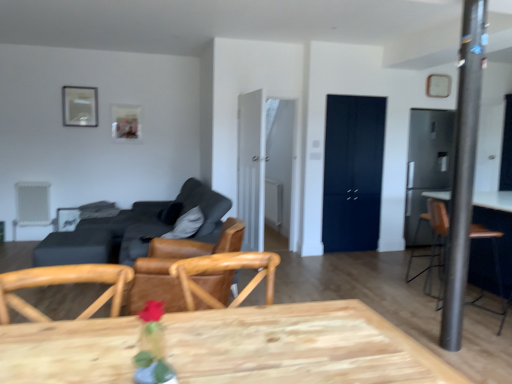
This screenshot has height=384, width=512. What do you see at coordinates (437, 236) in the screenshot? I see `brown leather armchair at right, which appears as the 1th armchair when viewed from the front` at bounding box center [437, 236].

This screenshot has height=384, width=512. What do you see at coordinates (73, 248) in the screenshot?
I see `wooden table at lower left` at bounding box center [73, 248].

Describe the element at coordinates (126, 123) in the screenshot. I see `metallic silver picture frame at upper center, the first picture frame positioned from the back` at that location.

The width and height of the screenshot is (512, 384). What do you see at coordinates (463, 170) in the screenshot?
I see `metallic pole at right` at bounding box center [463, 170].

What do you see at coordinates (170, 264) in the screenshot? I see `brown leather chair at center` at bounding box center [170, 264].

The width and height of the screenshot is (512, 384). In order to click on brown leather armchair at right, which appears as the 1th armchair when viewed from the front in this screenshot , I will do `click(437, 236)`.

Who is shorter, metallic pole at right or brown leather chair at center?

Standing shorter between the two is brown leather chair at center.

Does metallic pole at right turn towards brown leather chair at center?

No, metallic pole at right does not turn towards brown leather chair at center.

From a real-world perspective, is metallic pole at right located beneath brown leather chair at center?

No, from a real-world perspective, metallic pole at right is not under brown leather chair at center.

Is metallic pole at right not near brown leather chair at center?

Yes, metallic pole at right and brown leather chair at center are quite far apart.

Is wooden table at lower left bigger or smaller than satin black refrigerator at right?

In the image, wooden table at lower left appears to be smaller than satin black refrigerator at right.

From a real-world perspective, is wooden table at lower left physically located above or below satin black refrigerator at right?

From a real-world perspective, wooden table at lower left is physically below satin black refrigerator at right.

You are a GUI agent. You are given a task and a screenshot of the screen. Output one action in this format:
    pyautogui.click(x=<x>, y=<y>)
    Task: Click on the table located below the satin black refrigerator at right (from the image's perspective)
    
    Given the screenshot: What is the action you would take?
    pyautogui.click(x=73, y=248)

Between wooden table at lower left and satin black refrigerator at right, which one has smaller width?

satin black refrigerator at right.

Is brown leather chair at center positioned beyond the bounds of metallic pole at right?

Yes.

How many degrees apart are the facing directions of brown leather chair at center and metallic pole at right?

105 degrees separate the facing orientations of brown leather chair at center and metallic pole at right.

Is brown leather chair at center looking in the opposite direction of metallic pole at right?

That's right, brown leather chair at center is facing away from metallic pole at right.

Is wooden picture frame at upper right, marked as the 1th picture frame in a right-to-left arrangement, to the left or to the right of metallic pole at right in the image?

wooden picture frame at upper right, marked as the 1th picture frame in a right-to-left arrangement, is positioned on metallic pole at right's right side.

Are wooden picture frame at upper right, the 3th picture frame when ordered from left to right, and metallic pole at right making contact?

wooden picture frame at upper right, the 3th picture frame when ordered from left to right, and metallic pole at right are clearly separated.

From the image's perspective, which object appears higher, wooden picture frame at upper right, placed as the 1th picture frame when sorted from front to back, or metallic pole at right?

wooden picture frame at upper right, placed as the 1th picture frame when sorted from front to back, is shown above in the image.

Choose the correct answer: Is brown leather chair at center inside wooden picture frame at upper right, the 3th picture frame when ordered from left to right, or outside it?

brown leather chair at center exists outside the volume of wooden picture frame at upper right, the 3th picture frame when ordered from left to right.

Considering the sizes of objects brown leather chair at center and wooden picture frame at upper right, marked as the 1th picture frame in a right-to-left arrangement, in the image provided, who is wider, brown leather chair at center or wooden picture frame at upper right, marked as the 1th picture frame in a right-to-left arrangement,?

brown leather chair at center is wider.

Is point (187, 255) closer or farther from the camera than point (430, 82)?

Point (187, 255) appears to be closer to the viewer than point (430, 82).

Is brown leather chair at center next to wooden picture frame at upper right, the 3th picture frame when ordered from left to right, and touching it?

brown leather chair at center is not next to wooden picture frame at upper right, the 3th picture frame when ordered from left to right, and they're not touching.

Does point (464, 76) appear closer or farther from the camera than point (57, 232)?

Point (464, 76) is closer to the camera than point (57, 232).

Can we say metallic pole at right lies outside wooden table at lower left?

Yes, metallic pole at right is outside of wooden table at lower left.

From the image's perspective, which one is positioned lower, metallic pole at right or wooden table at lower left?

wooden table at lower left, from the image's perspective.

Find the location of `beam on the right of wooden table at lower left`. beam on the right of wooden table at lower left is located at coordinates (463, 170).

From a real-world perspective, who is located higher, metallic silver picture frame at upper center, arranged as the second picture frame when viewed from the left, or dark gray fabric couch at center-left?

metallic silver picture frame at upper center, arranged as the second picture frame when viewed from the left, from a real-world perspective.

Can dark gray fabric couch at center-left be found inside metallic silver picture frame at upper center, positioned as the third picture frame in front-to-back order?

Definitely not — dark gray fabric couch at center-left is not inside metallic silver picture frame at upper center, positioned as the third picture frame in front-to-back order.

Find the location of a particular element. The height and width of the screenshot is (384, 512). studio couch located underneath the metallic silver picture frame at upper center, arranged as the second picture frame when viewed from the left (from a real-world perspective) is located at coordinates (132, 230).

The image size is (512, 384). Find the location of `beam above the brown leather chair at center (from the image's perspective)`. beam above the brown leather chair at center (from the image's perspective) is located at coordinates pyautogui.click(x=463, y=170).

There is a wooden table at lower left. What are the coordinates of `appliance above it (from a real-world perspective)` in the screenshot? It's located at (426, 167).

Looking at the image, which one is located further to satin black refrigerator at right, brown leather armchair at right, which is counted as the 2th armchair, starting from the left, or brown leather chair at center?

The object further to satin black refrigerator at right is brown leather chair at center.

From the image, which object appears to be nearer to brown leather armchair at right, which appears as the 2th armchair when viewed from the back, dark gray fabric couch at center-left or metallic pole at right?

metallic pole at right lies closer to brown leather armchair at right, which appears as the 2th armchair when viewed from the back, than the other object.

Estimate the real-world distances between objects in this image. Which object is further from brown leather chair at center, wooden table at lower left or metallic silver picture frame at upper left, the 2th picture frame viewed from the front?

metallic silver picture frame at upper left, the 2th picture frame viewed from the front, is further to brown leather chair at center.

Based on their spatial positions, is leather armchair at left, placed as the 1th armchair when sorted from back to front, or metallic silver picture frame at upper center, positioned as the third picture frame in front-to-back order, further from wooden table at lower left?

Among the two, metallic silver picture frame at upper center, positioned as the third picture frame in front-to-back order, is located further to wooden table at lower left.

From the image, which object appears to be nearer to dark gray fabric couch at center-left, metallic pole at right or brown leather chair at center?

The object closer to dark gray fabric couch at center-left is brown leather chair at center.

Looking at the image, which one is located closer to metallic silver picture frame at upper left, the 3th picture frame positioned from the right, metallic silver picture frame at upper center, positioned as the third picture frame in front-to-back order, or brown leather armchair at right, which appears as the 1th armchair when viewed from the front?

metallic silver picture frame at upper center, positioned as the third picture frame in front-to-back order.

Estimate the real-world distances between objects in this image. Which object is further from metallic silver picture frame at upper center, positioned as the third picture frame in front-to-back order, wooden table at lower left or brown leather armchair at right, which appears as the 1th armchair when viewed from the right?

Among the two, brown leather armchair at right, which appears as the 1th armchair when viewed from the right, is located further to metallic silver picture frame at upper center, positioned as the third picture frame in front-to-back order.

Based on their spatial positions, is dark gray fabric couch at center-left or wooden picture frame at upper right, the 3th picture frame when ordered from left to right, closer to metallic silver picture frame at upper center, the first picture frame positioned from the back?

Based on the image, dark gray fabric couch at center-left appears to be nearer to metallic silver picture frame at upper center, the first picture frame positioned from the back.

Find the location of a particular element. The image size is (512, 384). appliance between brown leather chair at center and wooden picture frame at upper right, which ranks as the 3th picture frame in back-to-front order, in the horizontal direction is located at coordinates 426,167.

At what (x,y) coordinates should I click in order to perform the action: click on chair between metallic silver picture frame at upper left, the 2th picture frame viewed from the front, and metallic pole at right. Please return your answer as a coordinate pair (x, y). The width and height of the screenshot is (512, 384). Looking at the image, I should click on (170, 264).

Image resolution: width=512 pixels, height=384 pixels. I want to click on armchair between wooden table at lower left and satin black refrigerator at right, so click(x=437, y=236).

Find the location of `beam between leather armchair at left, placed as the 1th armchair when sorted from back to front, and wooden picture frame at upper right, the 3th picture frame when ordered from left to right, in the horizontal direction`. beam between leather armchair at left, placed as the 1th armchair when sorted from back to front, and wooden picture frame at upper right, the 3th picture frame when ordered from left to right, in the horizontal direction is located at coordinates (463, 170).